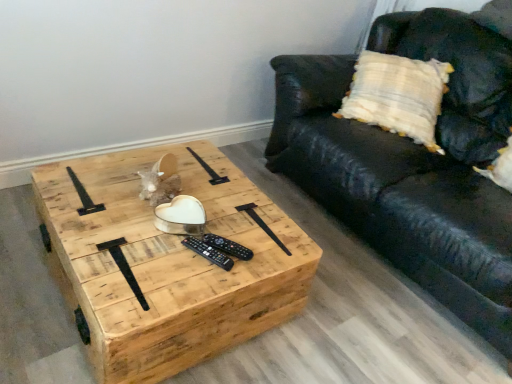
This screenshot has height=384, width=512. Identify the location of vacant area to the left of black plastic remote at center, the 2th remote in the back-to-front sequence. (147, 245).